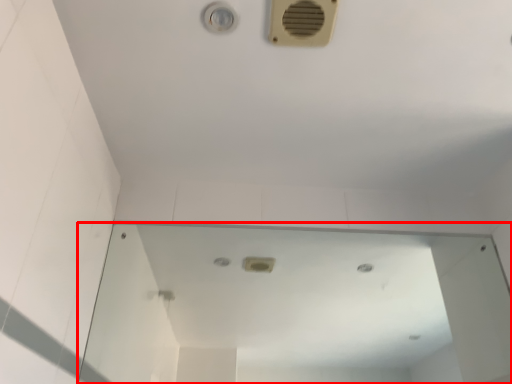
Question: Observing the image, what is the correct spatial positioning of mirror (annotated by the red box) in reference to air conditioning?

Choices:
 (A) left
 (B) right

Answer: (B)